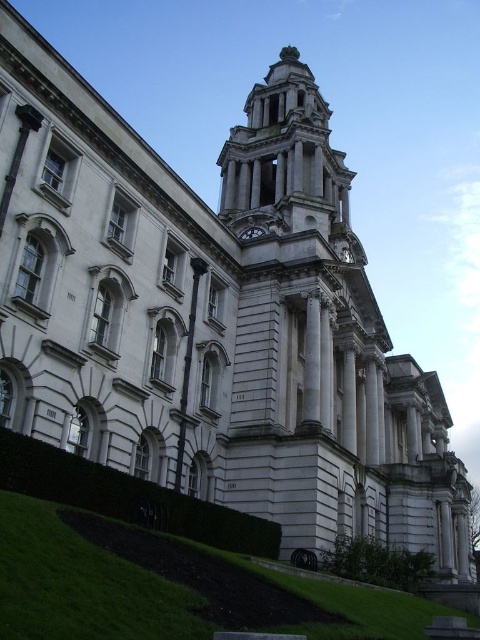
You are standing in front of the grand neoclassical building and want to take a photo of the white stone clock tower at center. Where should you position yourself to capture the tower in the center of your photo?

Position yourself directly in front of the white stone clock tower at center, which is located at coordinates point (285, 157), to ensure it appears centered in your photo.

You are standing in front of a historic building and want to take a photo of the central tower. There is a point at coordinates point (241, 140) that you need to focus on. If your camera can focus on objects up to 100 meters away, will you be able to focus on that point?

The distance of point (241, 140) from the camera is 94.98 meters, which is within the camera focus range of up to 100 meters. Therefore, the camera can focus on that point.

Based on the scene description, where is the white stone clock tower at center located in relation to the point with coordinates (285, 157)?

The white stone clock tower at center is located exactly at the point with coordinates (285, 157).